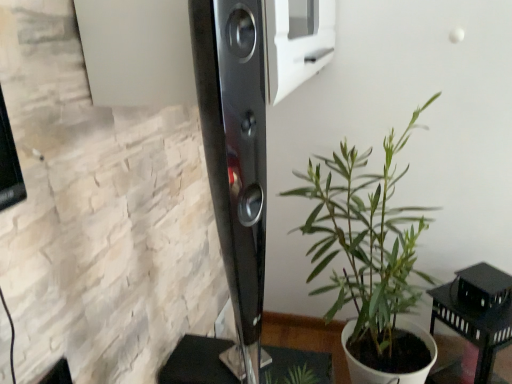
Question: Is green leafy plant at center oriented away from black matte table at lower right?

Choices:
 (A) yes
 (B) no

Answer: (B)

Question: Considering the relative sizes of green leafy plant at center and black matte table at lower right in the image provided, is green leafy plant at center bigger than black matte table at lower right?

Choices:
 (A) yes
 (B) no

Answer: (A)

Question: From a real-world perspective, is green leafy plant at center positioned over black matte table at lower right based on gravity?

Choices:
 (A) no
 (B) yes

Answer: (B)

Question: Is green leafy plant at center at the left side of black matte table at lower right?

Choices:
 (A) yes
 (B) no

Answer: (A)

Question: Is the position of green leafy plant at center more distant than that of black matte table at lower right?

Choices:
 (A) yes
 (B) no

Answer: (B)

Question: Is green leafy plant at center closer to camera compared to black matte table at lower right?

Choices:
 (A) no
 (B) yes

Answer: (B)

Question: Does black matte table at lower right have a larger size compared to green leafy plant at center?

Choices:
 (A) yes
 (B) no

Answer: (B)

Question: Could you tell me if black matte table at lower right is facing green leafy plant at center?

Choices:
 (A) yes
 (B) no

Answer: (B)

Question: Is black matte table at lower right smaller than green leafy plant at center?

Choices:
 (A) no
 (B) yes

Answer: (B)

Question: Is black matte table at lower right positioned in front of green leafy plant at center?

Choices:
 (A) yes
 (B) no

Answer: (B)

Question: Can you confirm if black matte table at lower right is thinner than green leafy plant at center?

Choices:
 (A) no
 (B) yes

Answer: (B)

Question: Can you confirm if black matte table at lower right is taller than green leafy plant at center?

Choices:
 (A) yes
 (B) no

Answer: (B)

Question: Is black matte table at lower right taller or shorter than green leafy plant at center?

Choices:
 (A) short
 (B) tall

Answer: (A)